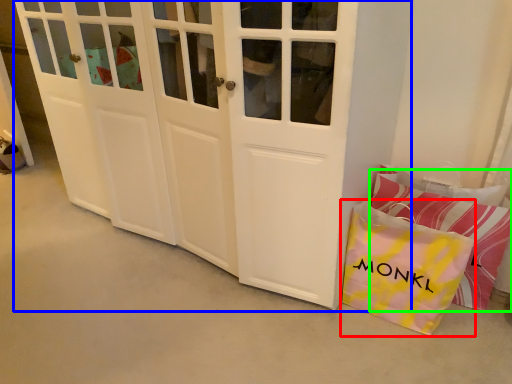
Question: Which object is positioned closest to gift bag (highlighted by a red box)? Select from door (highlighted by a blue box) and pillow (highlighted by a green box).

Choices:
 (A) door
 (B) pillow

Answer: (B)